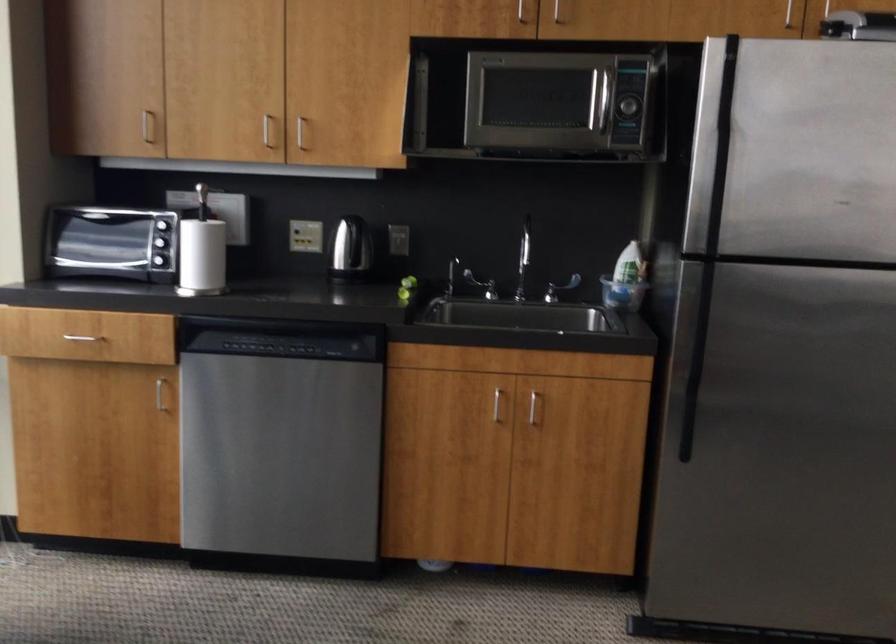
The width and height of the screenshot is (896, 644). Find the location of `microwave control dial`. microwave control dial is located at coordinates (626, 106).